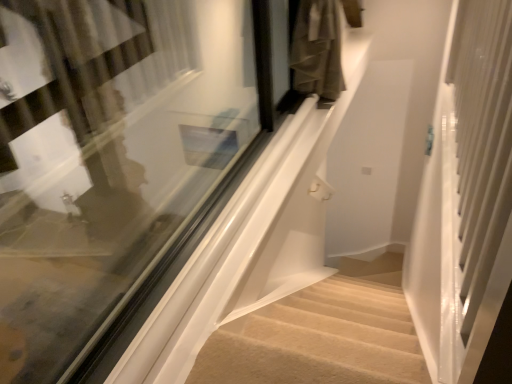
What do you see at coordinates (475, 184) in the screenshot? I see `white glossy screen door at right` at bounding box center [475, 184].

Where is `beige carpeted stairs at lower center`? The height and width of the screenshot is (384, 512). beige carpeted stairs at lower center is located at coordinates (318, 339).

Based on the photo, is clear glass window at center with white glossy screen door at right?

No, clear glass window at center is not in contact with white glossy screen door at right.

At what (x,y) coordinates should I click in order to perform the action: click on window located behind the white glossy screen door at right. Please return your answer as a coordinate pair (x, y). This screenshot has height=384, width=512. Looking at the image, I should click on (120, 161).

From a real-world perspective, which is physically above, clear glass window at center or white glossy screen door at right?

white glossy screen door at right, from a real-world perspective.

Which of these two, clear glass window at center or white glossy screen door at right, is thinner?

Thinner between the two is clear glass window at center.

Considering the sizes of objects beige carpeted stairs at lower center and clear glass window at center in the image provided, who is wider, beige carpeted stairs at lower center or clear glass window at center?

With larger width is clear glass window at center.

From the image's perspective, is beige carpeted stairs at lower center on clear glass window at center?

Actually, beige carpeted stairs at lower center appears below clear glass window at center in the image.

Considering the relative positions of beige carpeted stairs at lower center and clear glass window at center in the image provided, is beige carpeted stairs at lower center to the right of clear glass window at center from the viewer's perspective?

No.

Is point (394, 293) positioned in front of point (34, 102)?

That is False.

Does point (482, 41) come behind point (403, 370)?

Yes, it is.

Is beige carpeted stairs at lower center a part of white glossy screen door at right?

That's incorrect, beige carpeted stairs at lower center is not inside white glossy screen door at right.

From a real-world perspective, which object rests below the other?

beige carpeted stairs at lower center.

I want to click on screen door in front of the beige carpeted stairs at lower center, so click(475, 184).

Can you confirm if beige carpeted stairs at lower center is taller than white glossy screen door at right?

Incorrect, the height of beige carpeted stairs at lower center is not larger of that of white glossy screen door at right.

Is the surface of beige carpeted stairs at lower center in direct contact with white glossy screen door at right?

No, beige carpeted stairs at lower center is not beside white glossy screen door at right.

From a real-world perspective, is beige carpeted stairs at lower center physically above white glossy screen door at right?

Actually, beige carpeted stairs at lower center is physically below white glossy screen door at right in the real world.

Considering the relative positions of beige carpeted stairs at lower center and white glossy screen door at right in the image provided, is beige carpeted stairs at lower center to the left of white glossy screen door at right from the viewer's perspective?

Indeed, beige carpeted stairs at lower center is positioned on the left side of white glossy screen door at right.

In order to click on window on the right of beige carpeted stairs at lower center in this screenshot , I will do `click(120, 161)`.

Is clear glass window at center bigger or smaller than beige carpeted stairs at lower center?

clear glass window at center is bigger than beige carpeted stairs at lower center.

From a real-world perspective, is clear glass window at center positioned above or below beige carpeted stairs at lower center?

From a real-world perspective, clear glass window at center is physically above beige carpeted stairs at lower center.

What's the angular difference between clear glass window at center and beige carpeted stairs at lower center's facing directions?

The angular difference between clear glass window at center and beige carpeted stairs at lower center is 92.5 degrees.

From the picture: Is white glossy screen door at right positioned with its back to clear glass window at center?

No.

From a real-world perspective, who is located higher, white glossy screen door at right or clear glass window at center?

In real-world perspective, white glossy screen door at right is above.

Considering the sizes of objects white glossy screen door at right and clear glass window at center in the image provided, who is wider, white glossy screen door at right or clear glass window at center?

white glossy screen door at right is wider.

Identify the location of window above the white glossy screen door at right (from the image's perspective). (120, 161).

In the image, there is a clear glass window at center. Identify the location of stairs below it (from a real-world perspective). The width and height of the screenshot is (512, 384). (318, 339).

Looking at the image, which one is located further to white glossy screen door at right, clear glass window at center or beige carpeted stairs at lower center?

clear glass window at center.

Looking at the image, which one is located further to white glossy screen door at right, beige carpeted stairs at lower center or clear glass window at center?

clear glass window at center.

Looking at the image, which one is located closer to clear glass window at center, white glossy screen door at right or beige carpeted stairs at lower center?

Among the two, beige carpeted stairs at lower center is located nearer to clear glass window at center.

Estimate the real-world distances between objects in this image. Which object is closer to beige carpeted stairs at lower center, white glossy screen door at right or clear glass window at center?

white glossy screen door at right lies closer to beige carpeted stairs at lower center than the other object.

Which object lies nearer to the anchor point clear glass window at center, beige carpeted stairs at lower center or white glossy screen door at right?

beige carpeted stairs at lower center is closer to clear glass window at center.

Which object lies nearer to the anchor point beige carpeted stairs at lower center, clear glass window at center or white glossy screen door at right?

white glossy screen door at right is positioned closer to the anchor beige carpeted stairs at lower center.

Where is `screen door between clear glass window at center and beige carpeted stairs at lower center from top to bottom`? The width and height of the screenshot is (512, 384). screen door between clear glass window at center and beige carpeted stairs at lower center from top to bottom is located at coordinates (475, 184).